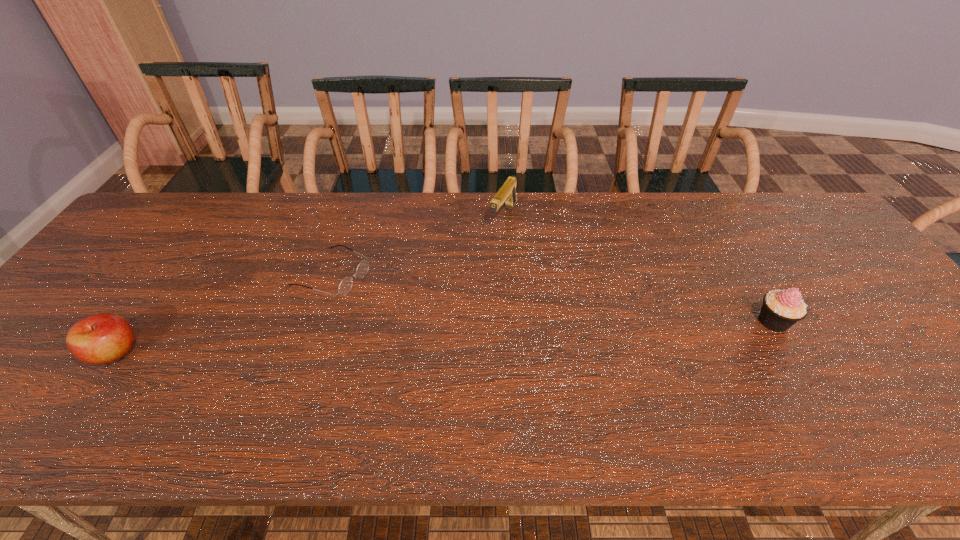
Find the location of a particular element. The width and height of the screenshot is (960, 540). vacant space on the desktop that is between the apple and the cupcake and is positioned at the barrel of the farthest object is located at coordinates (421, 338).

You are a GUI agent. You are given a task and a screenshot of the screen. Output one action in this format:
    pyautogui.click(x=<x>, y=<y>)
    Task: Click on the free space on the desktop that is between the leftmost object and the cupcake and is positioned through the lenses of the shortest object
    This screenshot has height=540, width=960.
    Given the screenshot: What is the action you would take?
    pyautogui.click(x=486, y=335)